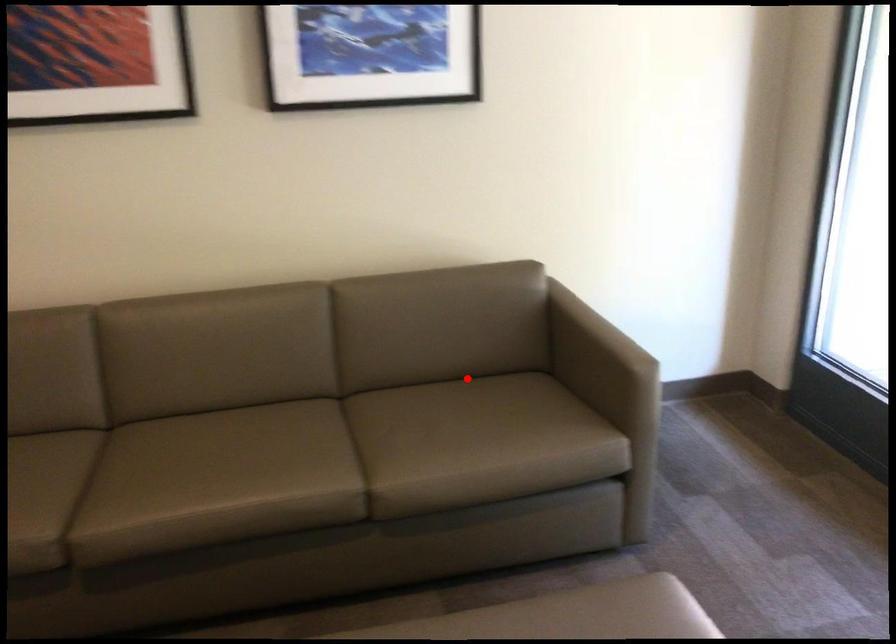
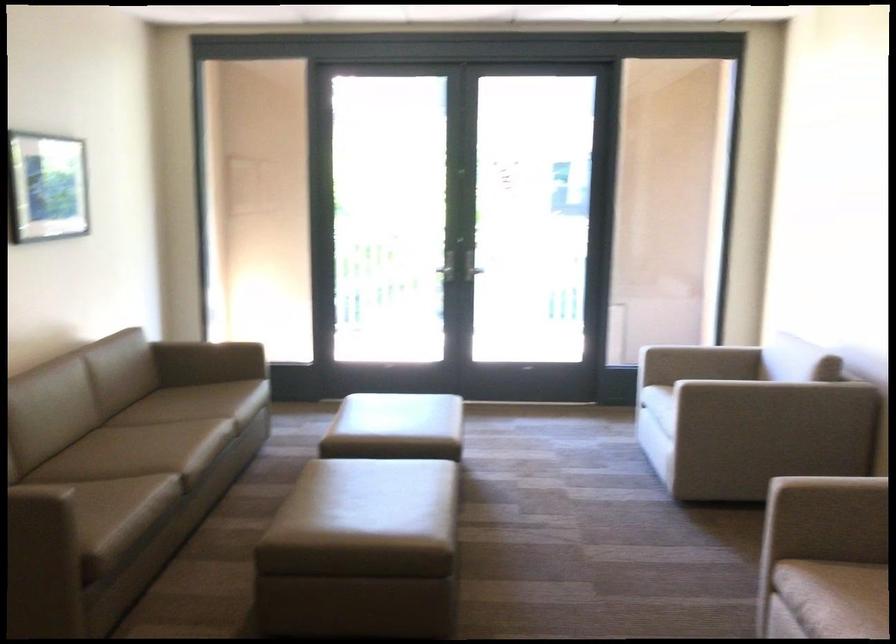
Question: I am providing you with two images of the same scene from different viewpoints. In image1, a red point is highlighted. Considering the same 3D point in image2, which of the following is correct?

Choices:
 (A) It is closer
 (B) It is farther

Answer: (B)